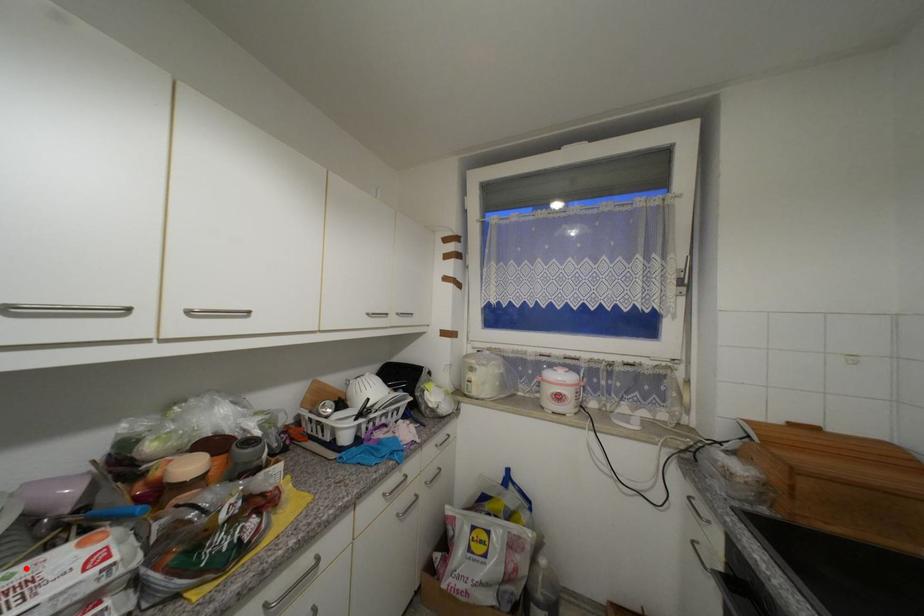
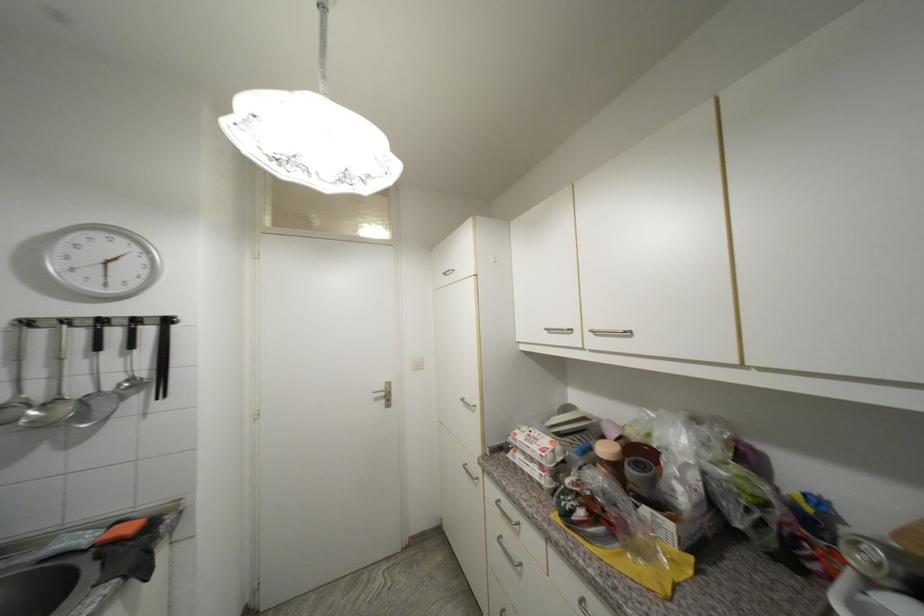
Question: I am providing you with two images of the same scene from different viewpoints. A red point is shown in image1. For the corresponding object point in image2, is it positioned nearer or farther from the camera?

Choices:
 (A) Nearer
 (B) Farther

Answer: (B)